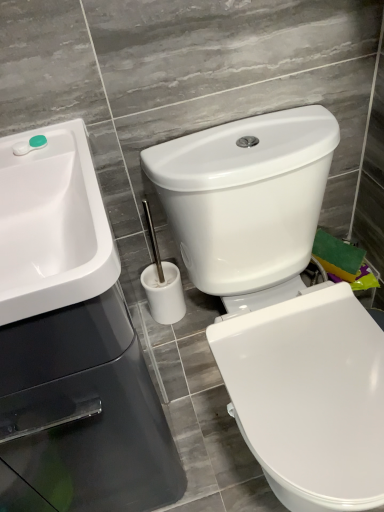
Question: Could you tell me if green plastic container at upper left is turned towards white glossy sink at upper left?

Choices:
 (A) no
 (B) yes

Answer: (B)

Question: Is green plastic container at upper left looking in the opposite direction of white glossy sink at upper left?

Choices:
 (A) no
 (B) yes

Answer: (B)

Question: Are green plastic container at upper left and white glossy sink at upper left located far from each other?

Choices:
 (A) yes
 (B) no

Answer: (B)

Question: Considering the relative sizes of green plastic container at upper left and white glossy sink at upper left in the image provided, is green plastic container at upper left thinner than white glossy sink at upper left?

Choices:
 (A) no
 (B) yes

Answer: (B)

Question: Does green plastic container at upper left come behind white glossy sink at upper left?

Choices:
 (A) no
 (B) yes

Answer: (B)

Question: Considering the relative positions of green plastic container at upper left and white glossy sink at upper left in the image provided, is green plastic container at upper left in front of white glossy sink at upper left?

Choices:
 (A) yes
 (B) no

Answer: (B)

Question: Does white glossy toilet at center have a lesser width compared to white glossy sink at upper left?

Choices:
 (A) yes
 (B) no

Answer: (B)

Question: From the image's perspective, is white glossy toilet at center located beneath white glossy sink at upper left?

Choices:
 (A) yes
 (B) no

Answer: (A)

Question: Considering the relative sizes of white glossy toilet at center and white glossy sink at upper left in the image provided, is white glossy toilet at center wider than white glossy sink at upper left?

Choices:
 (A) yes
 (B) no

Answer: (A)

Question: Is white glossy toilet at center at the left side of white glossy sink at upper left?

Choices:
 (A) no
 (B) yes

Answer: (A)

Question: Would you say white glossy toilet at center is a long distance from white glossy sink at upper left?

Choices:
 (A) yes
 (B) no

Answer: (B)

Question: Considering the relative positions of white glossy toilet at center and white glossy sink at upper left in the image provided, is white glossy toilet at center to the right of white glossy sink at upper left from the viewer's perspective?

Choices:
 (A) yes
 (B) no

Answer: (A)

Question: From a real-world perspective, is green plastic container at upper left over white glossy toilet at center?

Choices:
 (A) yes
 (B) no

Answer: (A)